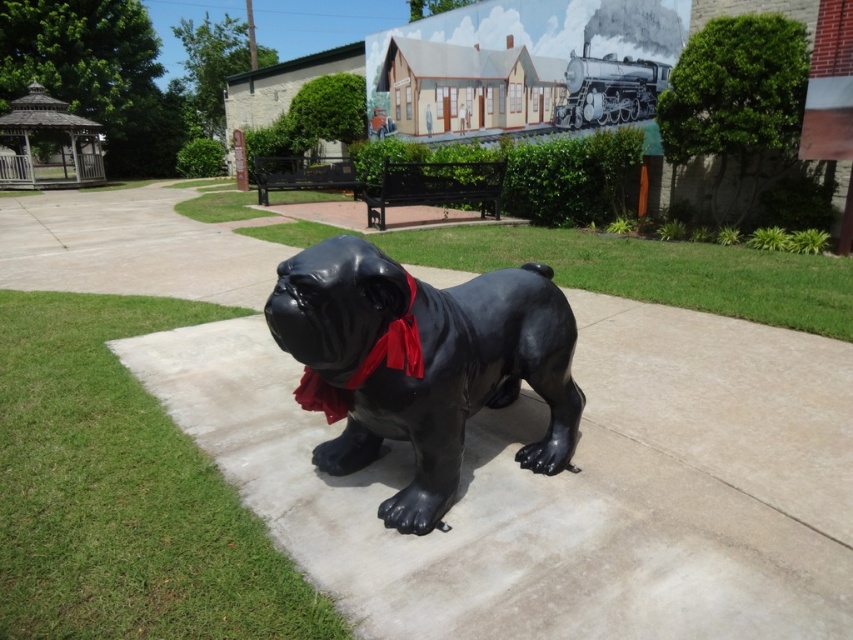
Can you confirm if glossy black dog at center is smaller than red satin neckband at center?

No.

Identify the location of glossy black dog at center. (421, 364).

Identify the location of glossy black dog at center. This screenshot has height=640, width=853. (421, 364).